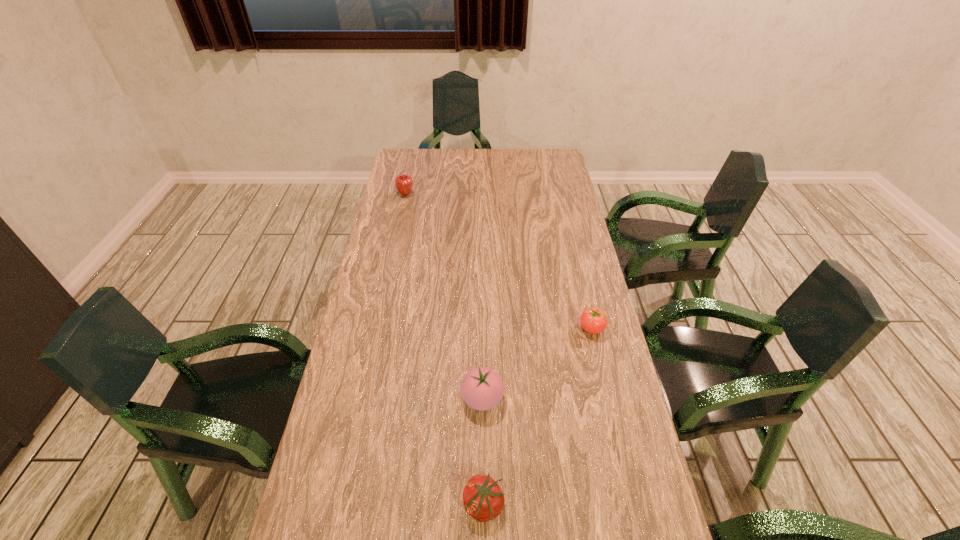
At what (x,y) coordinates should I click in order to perform the action: click on tomato identified as the second closest to the nearest tomato. Please return your answer as a coordinate pair (x, y). Looking at the image, I should click on (593, 320).

I want to click on vacant space that satisfies the following two spatial constraints: 1. on the front side of the apple; 2. on the left side of the nearest tomato, so click(x=339, y=505).

Locate an element on the screen. The image size is (960, 540). vacant position in the image that satisfies the following two spatial constraints: 1. on the front side of the rightmost tomato; 2. on the right side of the apple is located at coordinates (376, 328).

Find the location of a particular element. free space that satisfies the following two spatial constraints: 1. on the back side of the rightmost tomato; 2. on the left side of the tallest tomato is located at coordinates [x=482, y=328].

This screenshot has width=960, height=540. I want to click on free point that satisfies the following two spatial constraints: 1. on the front side of the tallest tomato; 2. on the right side of the nearest tomato, so click(x=483, y=505).